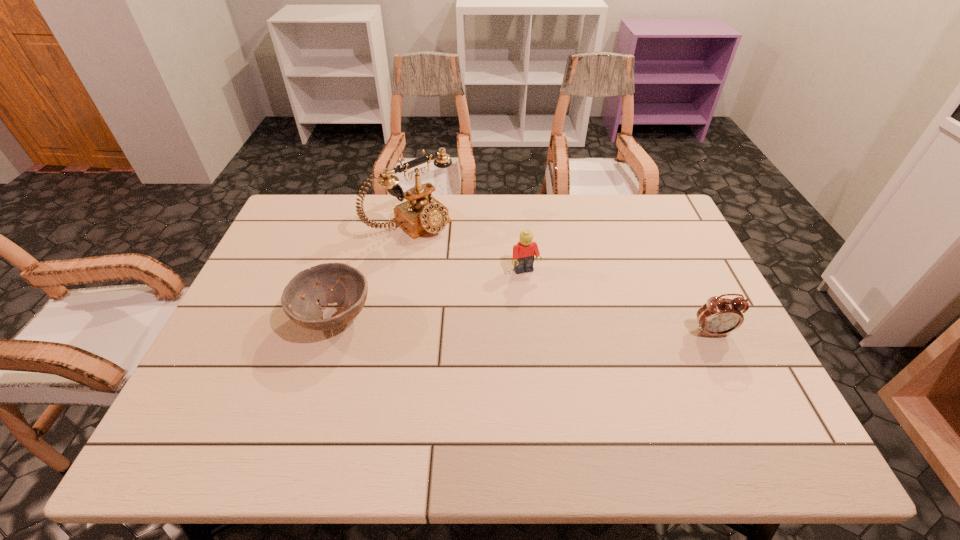
You are a GUI agent. You are given a task and a screenshot of the screen. Output one action in this format:
    pyautogui.click(x=<x>, y=<y>)
    Task: Click on the free space located 0.050m on the dial number of the tallest object
    The width and height of the screenshot is (960, 540).
    Given the screenshot: What is the action you would take?
    pyautogui.click(x=446, y=249)

You are a GUI agent. You are given a task and a screenshot of the screen. Output one action in this format:
    pyautogui.click(x=<x>, y=<y>)
    Task: Click on the blank area located 0.350m on the face of the Lego
    
    Given the screenshot: What is the action you would take?
    pyautogui.click(x=578, y=382)

Locate an element on the screen. This screenshot has width=960, height=540. vacant space situated on the face of the Lego is located at coordinates (564, 351).

The image size is (960, 540). Identify the location of free space located 0.210m on the face of the Lego. point(556,335).

Locate an element on the screen. This screenshot has height=540, width=960. object situated at the far edge is located at coordinates (421, 214).

You are a GUI agent. You are given a task and a screenshot of the screen. Output one action in this format:
    pyautogui.click(x=<x>, y=<y>)
    Task: Click on the object present at the left edge
    This screenshot has height=540, width=960.
    Given the screenshot: What is the action you would take?
    pyautogui.click(x=350, y=287)

This screenshot has height=540, width=960. What are the coordinates of `object present at the right edge` in the screenshot? It's located at (718, 316).

This screenshot has width=960, height=540. Identify the location of free space at the far edge. (560, 195).

The image size is (960, 540). Identify the location of free space at the near edge of the desktop. (445, 399).

The height and width of the screenshot is (540, 960). In the image, there is a desktop. In order to click on vacant space at the left edge in this screenshot , I will do `click(279, 264)`.